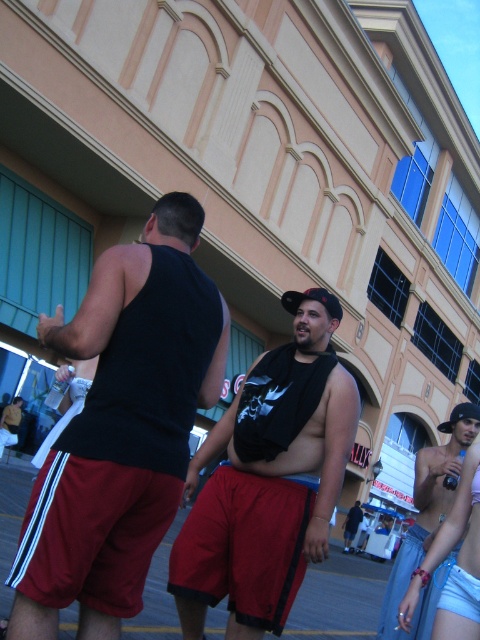
You are a photographer trying to capture both the black matte tank top at center and the matte black tank top at center in a single frame. Since the camera can only focus on one subject at a time, which subject should you choose to ensure the wider one is in focus?

The black matte tank top at center should be focused on because it is wider than the matte black tank top at center, ensuring the wider subject is in focus.

Consider the image. You are standing at the point with coordinates point [347,529] and want to walk towards the point with coordinates point [405,604]. Which direction should you move relative to your current position?

You should move forward because point [405,604] is in front of point [347,529].

Consider the image. You are a photographer trying to capture a photo of the black matte tank top at center and the nude skin at lower right. Based on their sizes, which object would appear larger in the final photo?

The black matte tank top at center would appear larger in the photo since it is much taller than the nude skin at lower right.